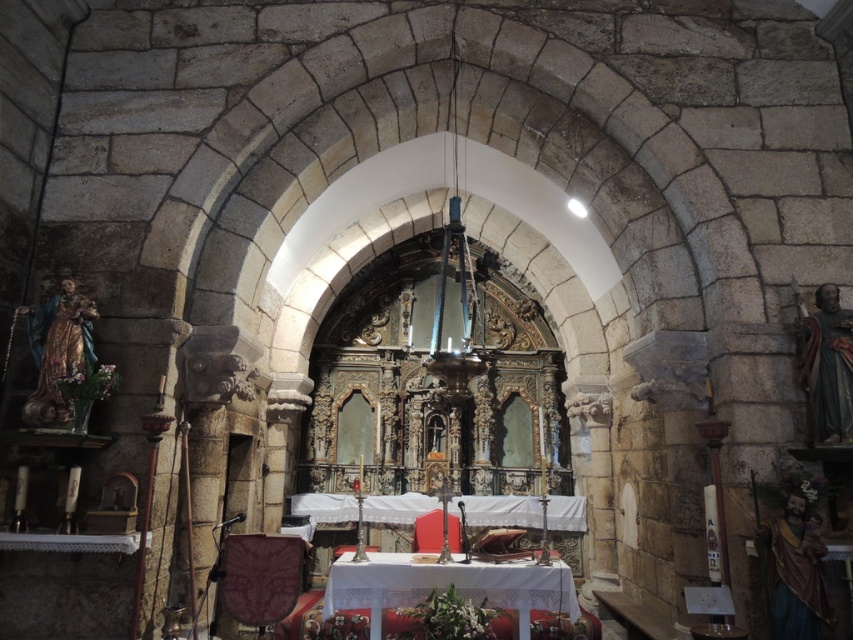
Can you confirm if velvet purple chair at center is positioned above velvet red chair at center?

Indeed, velvet purple chair at center is positioned over velvet red chair at center.

Is point (286, 561) closer to camera compared to point (434, 529)?

Yes.

Find the location of a particular element. Image resolution: width=853 pixels, height=640 pixels. velvet purple chair at center is located at coordinates (260, 577).